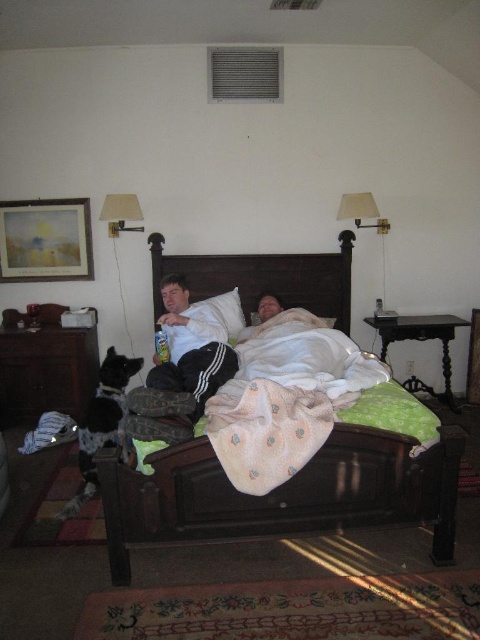
Who is taller, dark wood headboard at center or matte white lampshade at upper left?

Standing taller between the two is dark wood headboard at center.

Does dark wood headboard at center appear on the left side of matte white lampshade at upper left?

Incorrect, dark wood headboard at center is not on the left side of matte white lampshade at upper left.

Is point (255, 269) in front of point (132, 230)?

No, (255, 269) is behind (132, 230).

In order to click on dark wood headboard at center in this screenshot , I will do `click(264, 278)`.

Locate an element on the screen. The height and width of the screenshot is (640, 480). light pink soft fabric blanket at center is located at coordinates (285, 397).

Which of these two, light pink soft fabric blanket at center or dark wood headboard at center, stands taller?

Standing taller between the two is dark wood headboard at center.

The image size is (480, 640). Find the location of `light pink soft fabric blanket at center`. light pink soft fabric blanket at center is located at coordinates (285, 397).

Find the location of a particular element. Image resolution: width=480 pixels, height=640 pixels. light pink soft fabric blanket at center is located at coordinates (285, 397).

Is light pink soft fabric blanket at center closer to the viewer compared to white matte shirt at center?

Yes, it is in front of white matte shirt at center.

Is point (282, 356) behind point (173, 330)?

No, (282, 356) is in front of (173, 330).

Find the location of `light pink soft fabric blanket at center`. light pink soft fabric blanket at center is located at coordinates (285, 397).